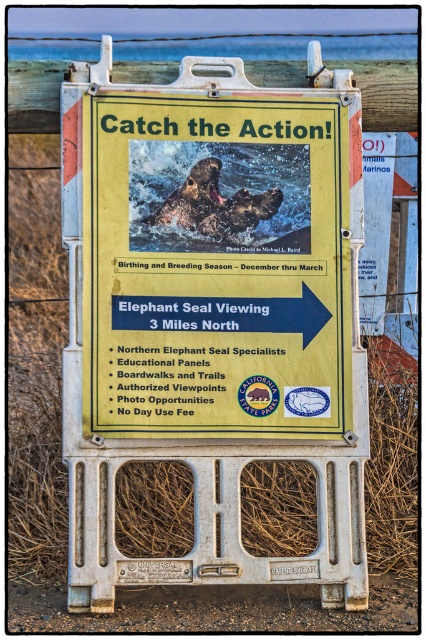
You are standing at the origin point of a coordinate system where the sign is placed at coordinates given in the description. If you want to move directly towards the yellow plastic sign at center, in which direction should you walk?

The yellow plastic sign at center is located at coordinates approximately 0.489 on the x and 0.5 on the y. Since you are at the origin, you should walk in the positive x and positive y direction to reach it.